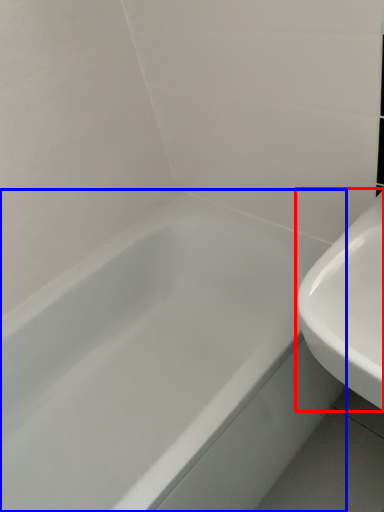
Question: Among these objects, which one is nearest to the camera, sink (highlighted by a red box) or bathtub (highlighted by a blue box)?

Choices:
 (A) sink
 (B) bathtub

Answer: (A)